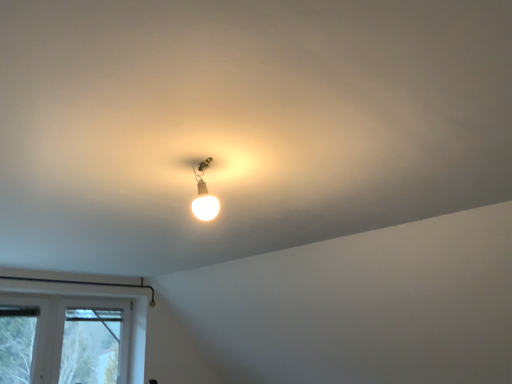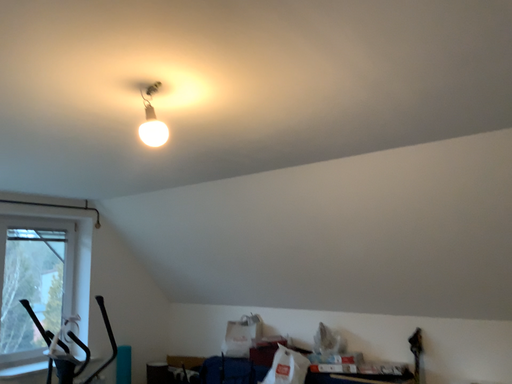
Question: Which way did the camera rotate in the video?

Choices:
 (A) rotated left
 (B) rotated right

Answer: (B)